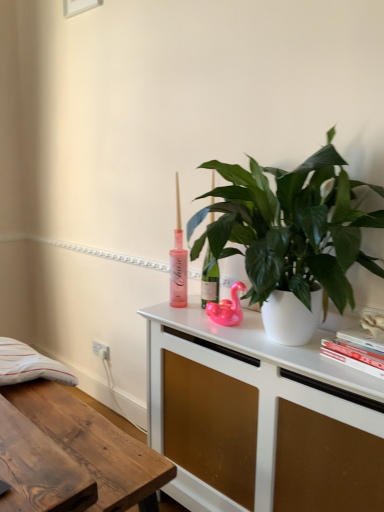
Locate an element on the screen. Image resolution: width=384 pixels, height=512 pixels. vacant space in front of pink rubber duck at center is located at coordinates (239, 339).